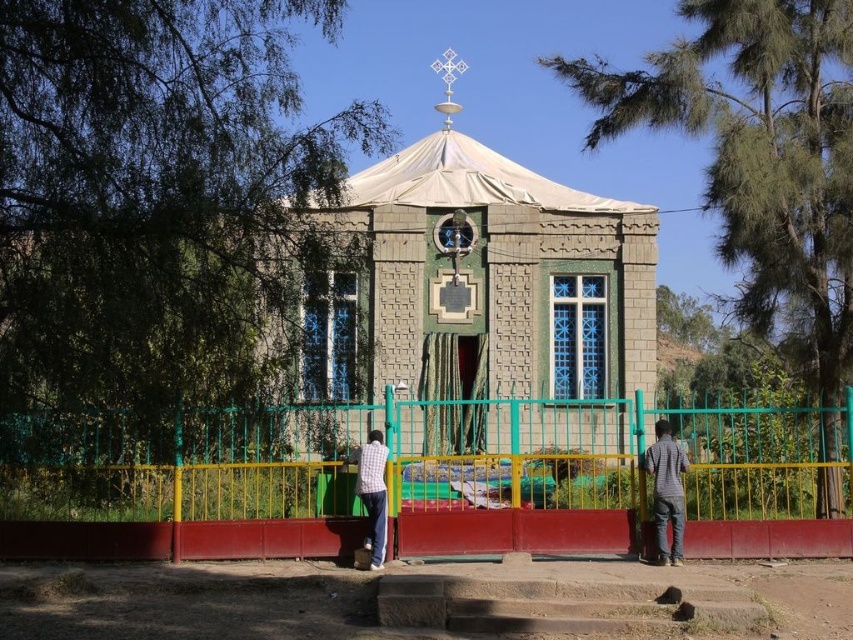
Which is in front, point (293, 518) or point (373, 481)?

Positioned in front is point (293, 518).

Is green metal fence at center further to the viewer compared to checkered fabric shirt at center?

Yes, green metal fence at center is further from the viewer.

Does point (170, 513) come in front of point (370, 445)?

No, it is behind (370, 445).

Image resolution: width=853 pixels, height=640 pixels. Find the location of `green metal fence at center`. green metal fence at center is located at coordinates (422, 480).

Can you confirm if gray striped shirt at right is positioned above checkered fabric shirt at center?

Yes.

Who is taller, gray striped shirt at right or checkered fabric shirt at center?

With more height is gray striped shirt at right.

Identify the location of gray striped shirt at right. The height and width of the screenshot is (640, 853). (666, 492).

You are a GUI agent. You are given a task and a screenshot of the screen. Output one action in this format:
    pyautogui.click(x=<x>, y=<y>)
    Task: Click on the gray striped shirt at right
    
    Given the screenshot: What is the action you would take?
    pyautogui.click(x=666, y=492)

How distant is green metal fence at center from gray striped shirt at right?

green metal fence at center is 51.77 feet away from gray striped shirt at right.

Which is below, green metal fence at center or gray striped shirt at right?

gray striped shirt at right

Who is more forward, (231, 513) or (688, 461)?

Positioned in front is point (688, 461).

The height and width of the screenshot is (640, 853). What are the coordinates of `green metal fence at center` in the screenshot? It's located at (422, 480).